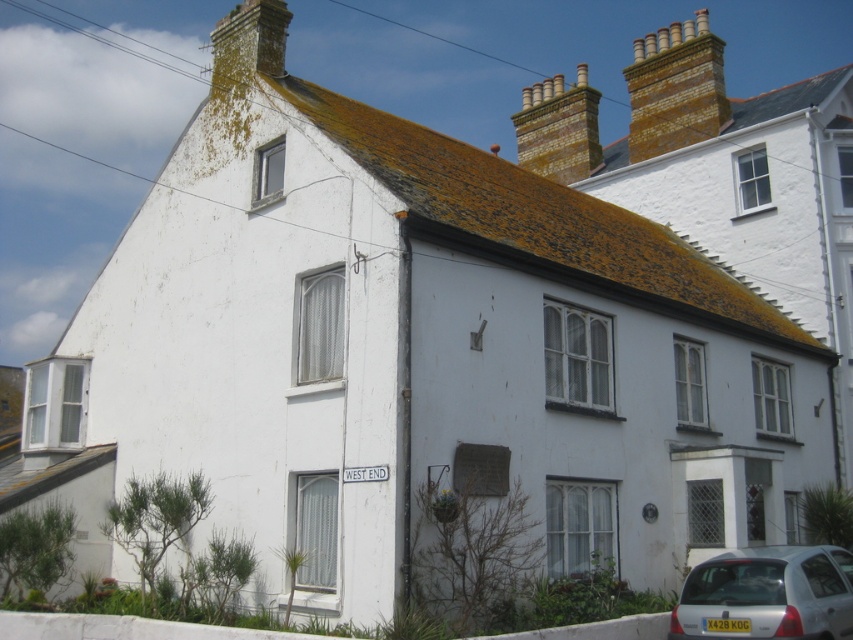
You are standing at the origin point of the coordinate system in this image. The white painted brick cottage at upper right is located at a specific coordinate. Can you tell me what its coordinates are?

The white painted brick cottage at upper right is located at coordinates point (722, 177).

You are standing in front of the house and want to take a photo that includes both the white painted brick cottage at upper right and the silver metallic car at lower right. Which object should you position closer to the camera to ensure both are in focus?

You should position the white painted brick cottage at upper right closer to the camera because it is further away than the silver metallic car at lower right, ensuring both are in focus.

You are standing on the sidewalk in front of the house and want to take a photo of both the white painted brick cottage at upper right and the silver metallic car at lower right. Which object should you point your camera towards first to include both in the frame?

You should point your camera towards the silver metallic car at lower right first because the white painted brick cottage at upper right is above it, so adjusting the angle upwards will capture both in the frame.